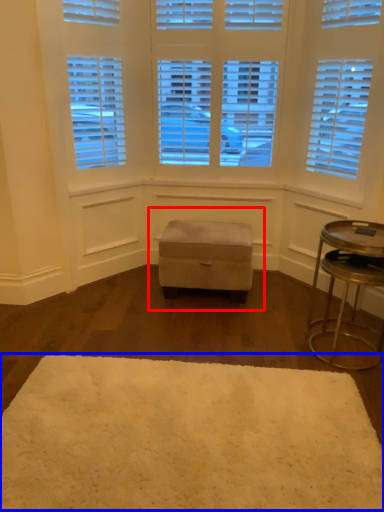
Question: Which of the following is the closest to the observer, music stool (highlighted by a red box) or mat (highlighted by a blue box)?

Choices:
 (A) music stool
 (B) mat

Answer: (B)